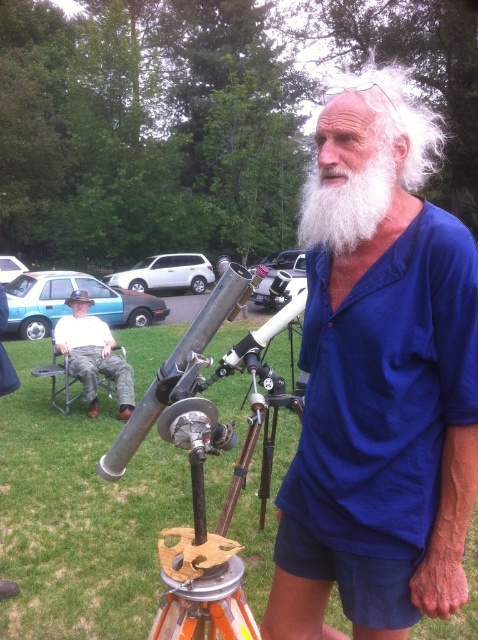
This screenshot has width=478, height=640. What do you see at coordinates (379, 380) in the screenshot? I see `whitewoollybeard at right` at bounding box center [379, 380].

Is point (414, 582) less distant than point (62, 342)?

Yes, point (414, 582) is in front of point (62, 342).

Is point (469, 499) more distant than point (132, 378)?

That is False.

The width and height of the screenshot is (478, 640). Identify the location of whitewoollybeard at right. (379, 380).

Who is shorter, whitewoollybeard at right or polished silver telescope at center?

Standing shorter between the two is polished silver telescope at center.

This screenshot has width=478, height=640. What do you see at coordinates (379, 380) in the screenshot? I see `whitewoollybeard at right` at bounding box center [379, 380].

Is point (290, 580) positioned in front of point (176, 630)?

No, it is not.

You are a GUI agent. You are given a task and a screenshot of the screen. Output one action in this format:
    pyautogui.click(x=<x>, y=<y>)
    Task: Click on the whitewoollybeard at right
    The width and height of the screenshot is (478, 640).
    Given the screenshot: What is the action you would take?
    pyautogui.click(x=379, y=380)

Can you confirm if polished silver telescope at center is smaller than white fluffy beard at center?

Correct, polished silver telescope at center occupies less space than white fluffy beard at center.

Between polished silver telescope at center and white fluffy beard at center, which one has less height?

polished silver telescope at center

Measure the distance between polished silver telescope at center and camera.

polished silver telescope at center and camera are 38.70 inches apart.

Identify the location of polished silver telescope at center. (204, 461).